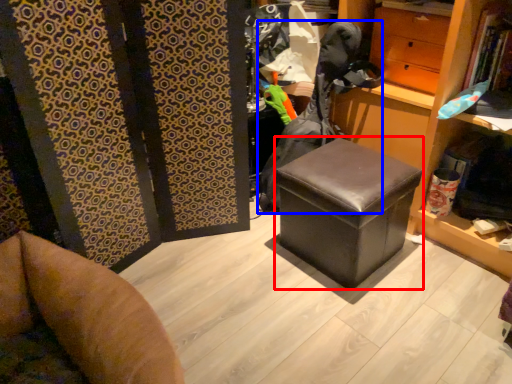
Question: Which point is further to the camera, stool (highlighted by a red box) or clothing (highlighted by a blue box)?

Choices:
 (A) stool
 (B) clothing

Answer: (B)